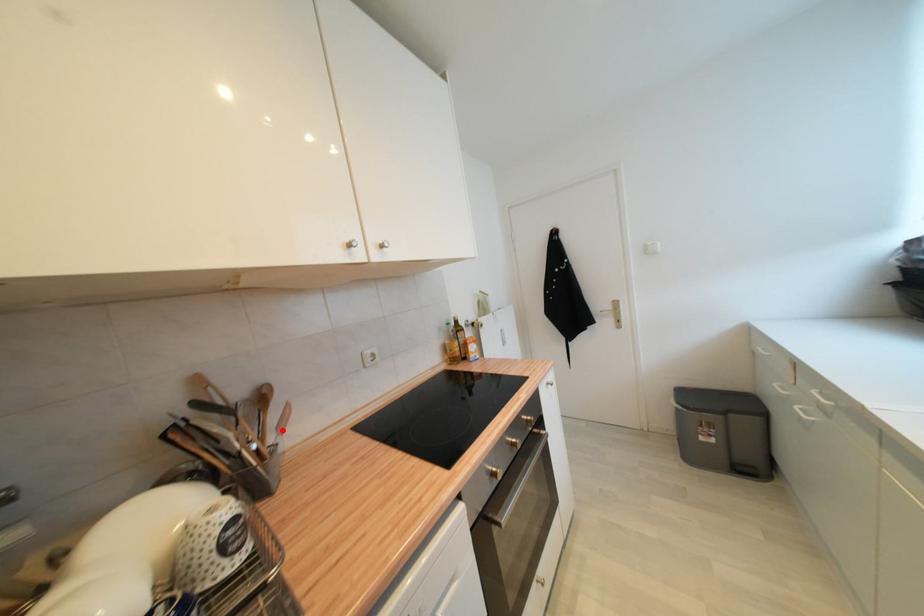
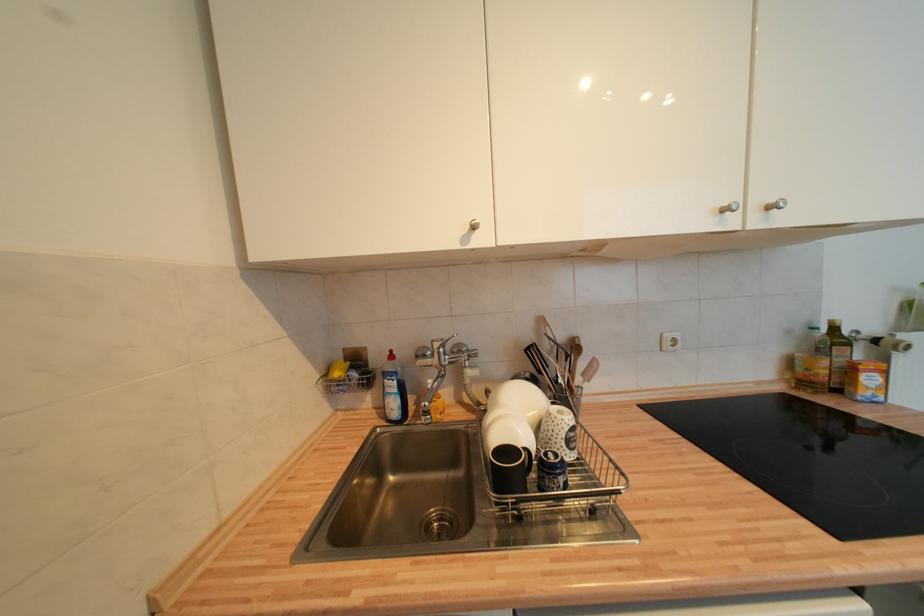
Question: I am providing you with two images of the same scene from different viewpoints. A red point is shown in image1. For the corresponding object point in image2, is it positioned nearer or farther from the camera?

Choices:
 (A) Nearer
 (B) Farther

Answer: (B)